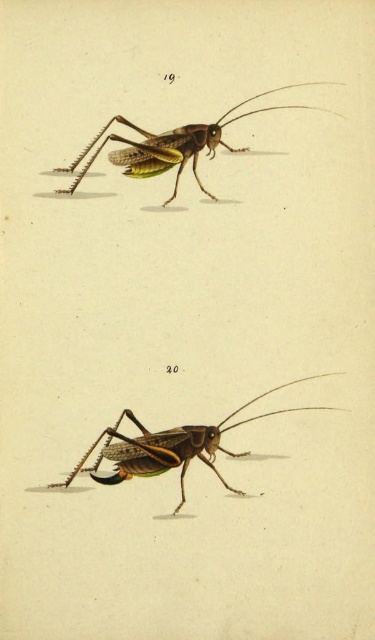
You are an entomologist examining two insects in the image. You notice both the shiny green exoskeleton at bottom center and the shiny green grasshopper at upper center. Which one is positioned lower in the image?

The shiny green exoskeleton at bottom center is positioned lower in the image than the shiny green grasshopper at upper center.

You are an entomologist examining two insects in the image. You notice both have shiny green parts. Which object is taller between the shiny green exoskeleton at bottom center and the shiny green grasshopper at upper center?

The shiny green exoskeleton at bottom center is much taller than the shiny green grasshopper at upper center.

You are standing 5 feet away from the camera. Can you reach the point labeled with coordinates point (135, 449) without moving closer to the camera?

The distance between point (135, 449) and the camera is 4.08 feet. Since you are currently 5 feet away from the camera, you are farther than the point, so you cannot reach it without moving closer.